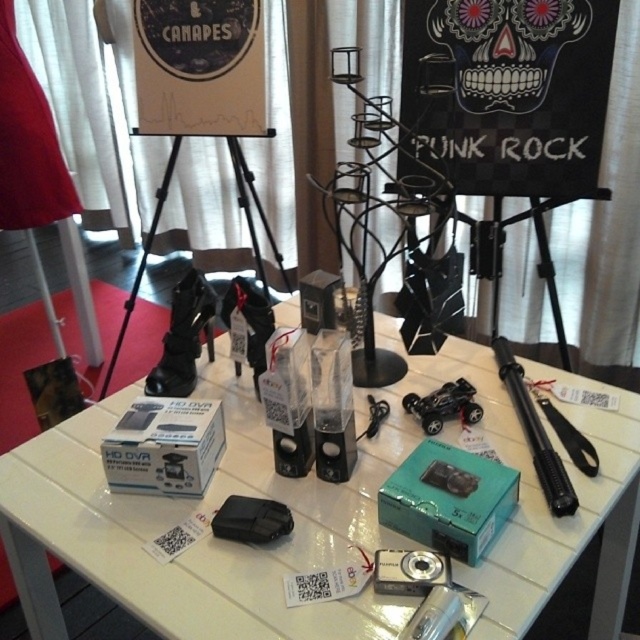
Question: Does black matte skull at upper center appear under black matte tripod at center?

Choices:
 (A) yes
 (B) no

Answer: (B)

Question: Among these points, which one is farthest from the camera?

Choices:
 (A) (513, 58)
 (B) (605, 611)
 (C) (122, 333)
 (D) (416, 406)

Answer: (C)

Question: Estimate the real-world distances between objects in this image. Which object is closer to the white glossy table at center?

Choices:
 (A) black matte tripod at center
 (B) black matte skull at upper center
 (C) black plastic toy car at center

Answer: (C)

Question: Does black matte skull at upper center have a smaller size compared to black matte tripod at center?

Choices:
 (A) no
 (B) yes

Answer: (B)

Question: Which is nearer to the black plastic toy car at center?

Choices:
 (A) black matte skull at upper center
 (B) black matte tripod at center
 (C) white glossy table at center

Answer: (C)

Question: Does white glossy table at center appear on the left side of black matte tripod at center?

Choices:
 (A) yes
 (B) no

Answer: (B)